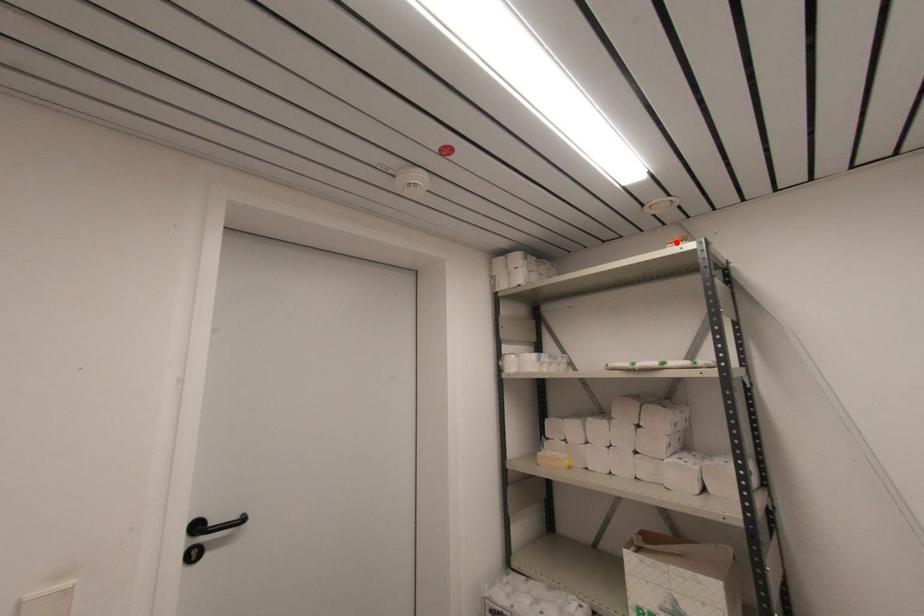
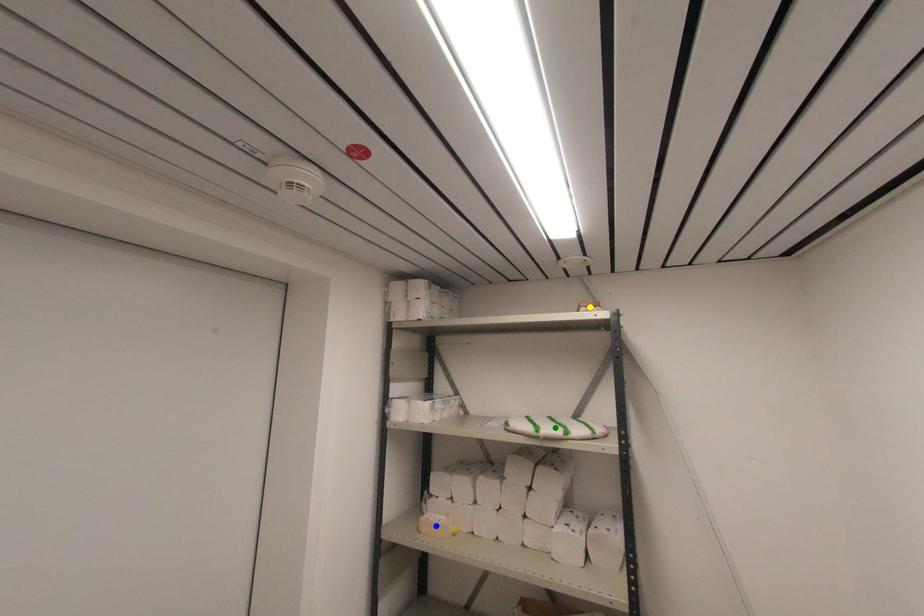
Question: I am providing you with two images of the same scene from different viewpoints. A red point is marked on the first image. You are given multiple points on the second image. Which spot in image 2 lines up with the point in image 1?

Choices:
 (A) green point
 (B) blue point
 (C) yellow point

Answer: (C)